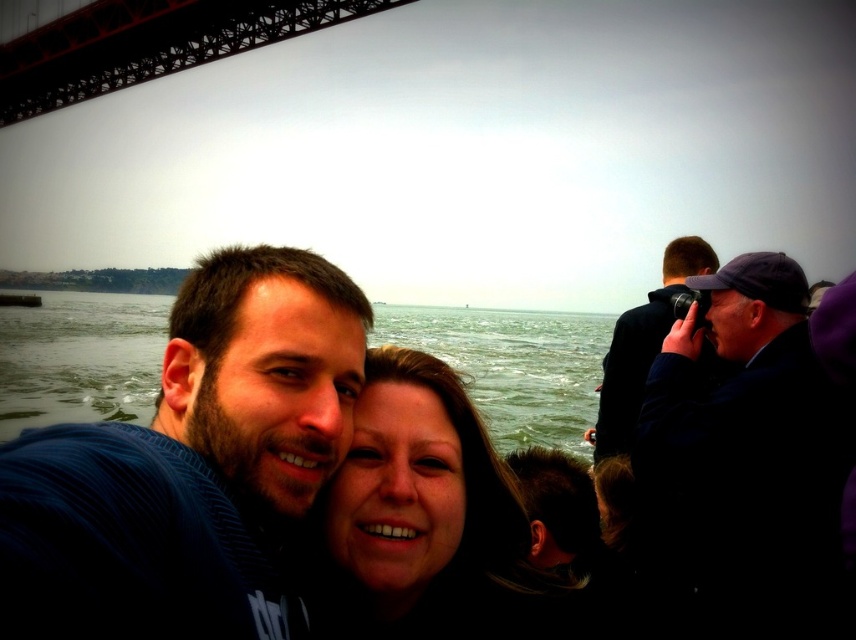
In the scene shown: Is green water at center wider than metallic bridge at upper left?

Yes.

Locate an element on the screen. The width and height of the screenshot is (856, 640). green water at center is located at coordinates (513, 365).

Can you confirm if smooth skin face at center is positioned to the left of black fabric camera at right?

Correct, you'll find smooth skin face at center to the left of black fabric camera at right.

Who is positioned more to the right, smooth skin face at center or black fabric camera at right?

Positioned to the right is black fabric camera at right.

The height and width of the screenshot is (640, 856). In order to click on smooth skin face at center in this screenshot , I will do `click(421, 522)`.

Does point (682, 348) come in front of point (492, 346)?

Yes, it is in front of point (492, 346).

In the scene shown: Can you confirm if dark blue fabric at right is positioned to the left of blue striped shirt at center?

No, dark blue fabric at right is not to the left of blue striped shirt at center.

Locate an element on the screen. Image resolution: width=856 pixels, height=640 pixels. dark blue fabric at right is located at coordinates (750, 452).

This screenshot has width=856, height=640. In order to click on dark blue fabric at right in this screenshot , I will do `click(750, 452)`.